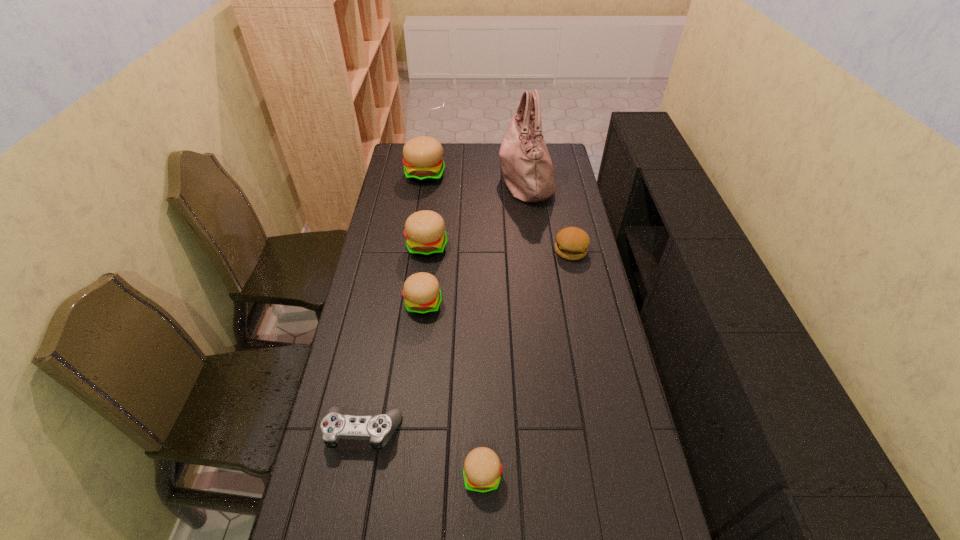
Identify the location of hamburger that is the closest to the third nearest beige hamburger. (422, 293).

Locate which beige hamburger is the third closest to the rightmost hamburger. Please provide its 2D coordinates. Your answer should be formatted as a tuple, i.e. [(x, y)], where the tuple contains the x and y coordinates of a point satisfying the conditions above.

[(423, 163)]

Identify which beige hamburger is located as the second nearest to the brown hamburger. Please provide its 2D coordinates. Your answer should be formatted as a tuple, i.e. [(x, y)], where the tuple contains the x and y coordinates of a point satisfying the conditions above.

[(422, 293)]